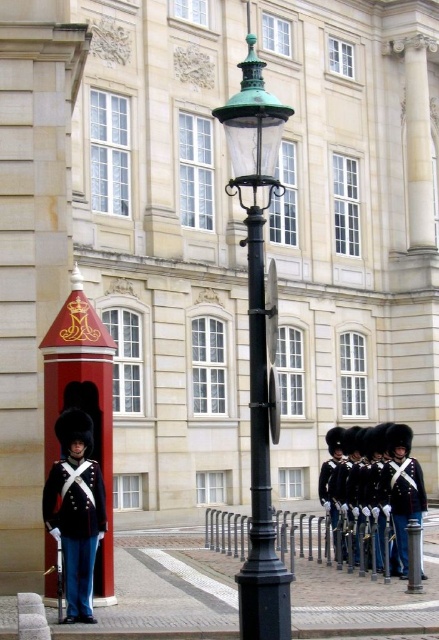
You are standing at the center of the paved area in front of the grand classical building. There is a black lamppost with a green glass lantern and a red sentry box with gold detailing and a crown emblem. Where is the point at coordinate (259, 340) located relative to the black lamppost with a green glass lantern?

The point at coordinate (259, 340) is located at the center of the green glass lamp post.

You are a tourist standing in front of the grand classical building. You see the green glass lamp post at center and the shiny black uniform at left. Which object is bigger?

The green glass lamp post at center is larger in size than the shiny black uniform at left.